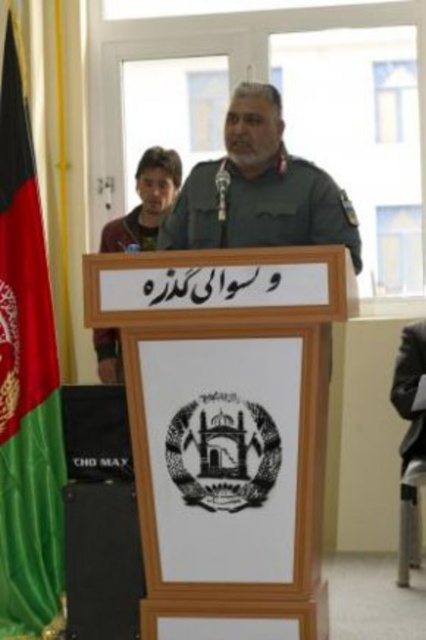
You are attending a formal event and notice a gray fabric chair at right and a green fabric uniform at center. Based on their positions, which object is closer to the floor?

The gray fabric chair at right is below the green fabric uniform at center, so the gray fabric chair at right is closer to the floor.

You are an event organizer planning to place a name tag on the green military uniform at center and the green fabric uniform at center. Which uniform should you choose to ensure the name tag is visible from a distance?

The green military uniform at center is larger in size than the green fabric uniform at center, so the name tag will be more visible on the larger uniform.

You are a photographer positioned at the center of the room. You want to take a photo that includes both the point at coordinates point (238,220) and point (143,244). Which point should you focus on first to ensure both are in frame?

You should focus on point (238,220) first because it is closer to you than point (143,244), which is further away. This ensures both points remain within the camera frame.